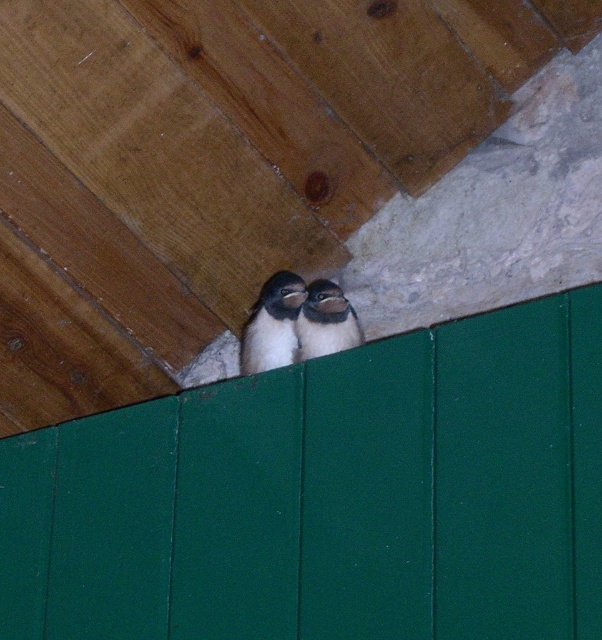
Question: Which object appears closest to the camera in this image?

Choices:
 (A) white matte penguin at center
 (B) white downy penguin at center

Answer: (A)

Question: Does white downy penguin at center appear under white matte penguin at center?

Choices:
 (A) yes
 (B) no

Answer: (A)

Question: Which point is closer to the camera?

Choices:
 (A) white matte penguin at center
 (B) white downy penguin at center

Answer: (A)

Question: Which point is closer to the camera?

Choices:
 (A) white matte penguin at center
 (B) white downy penguin at center

Answer: (A)

Question: Is white downy penguin at center positioned in front of white matte penguin at center?

Choices:
 (A) no
 (B) yes

Answer: (A)

Question: Does white downy penguin at center appear on the left side of white matte penguin at center?

Choices:
 (A) yes
 (B) no

Answer: (A)